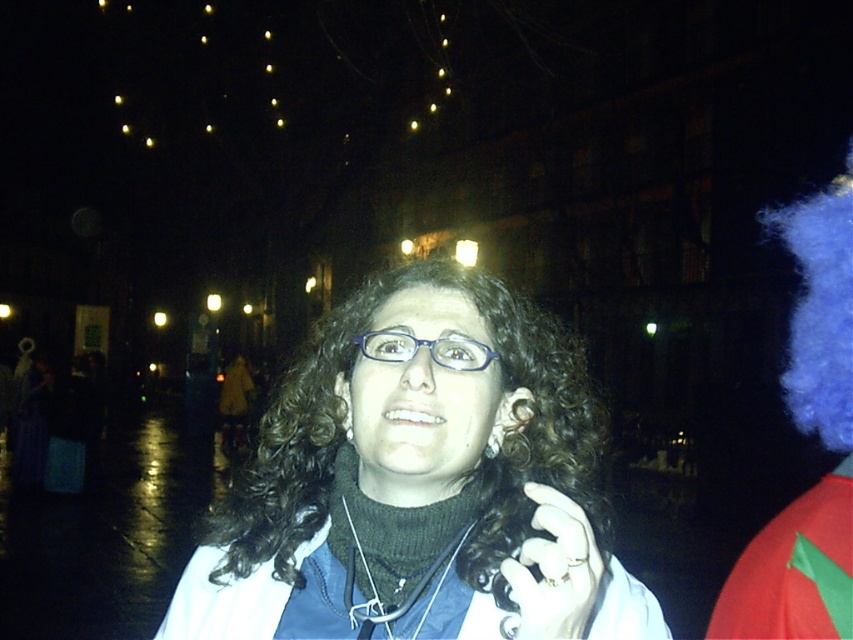
You are at a party and need to grab a pair of glasses from the table. There are two options available on the table in front of you. The matte blue glasses at center and the blue plastic glasses at center. Which one is positioned lower on the table?

The matte blue glasses at center is located below the blue plastic glasses at center, so it is positioned lower on the table.

You are standing in the scene and want to pick up the blue fluffy wig at right. Where should you look to find it?

The blue fluffy wig at right is located at point [820,438].

You are at a party and need to grab a pair of glasses from the table. There are two options available on the table in front of you. The matte blue glasses at center and the blue plastic glasses at center. Which one is located to the left?

The matte blue glasses at center is to the left of blue plastic glasses at center.